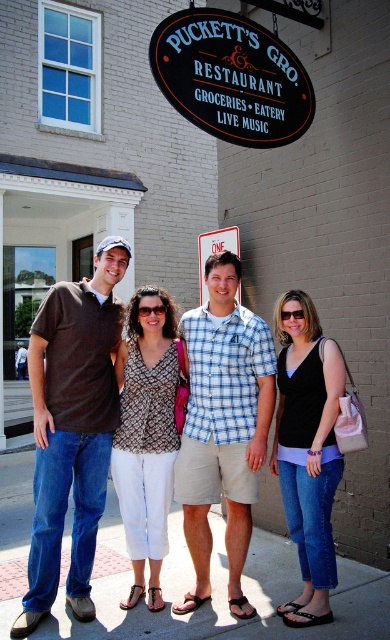
Question: Is blue plaid shirt at center below brown printed blouse at center?

Choices:
 (A) yes
 (B) no

Answer: (B)

Question: Which point is closer to the camera?

Choices:
 (A) (221, 244)
 (B) (44, 589)

Answer: (B)

Question: Which of the following is the farthest from the observer?

Choices:
 (A) black denim jeans at center
 (B) matte brown polo shirt at left
 (C) brushed metal sign at center
 (D) blue plaid shirt at center

Answer: (C)

Question: Can you confirm if matte brown polo shirt at left is positioned to the left of brushed metal sign at center?

Choices:
 (A) no
 (B) yes

Answer: (B)

Question: Which object is the farthest from the brushed metal sign at center?

Choices:
 (A) brown cotton shirt at center
 (B) matte brown polo shirt at left
 (C) black denim jeans at center

Answer: (B)

Question: Considering the relative positions of blue plaid shirt at center and brushed metal sign at center in the image provided, where is blue plaid shirt at center located with respect to brushed metal sign at center?

Choices:
 (A) below
 (B) above

Answer: (A)